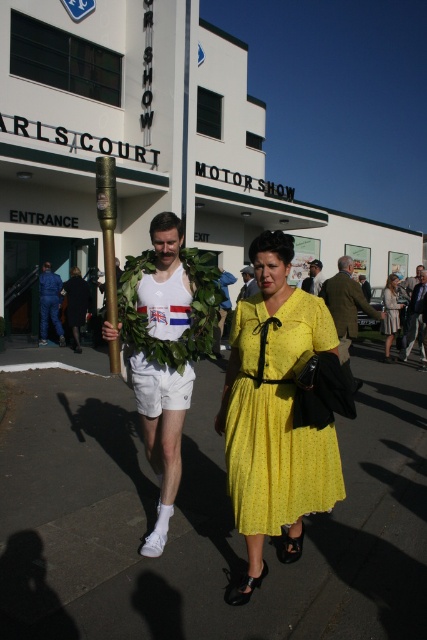
Question: Based on their relative distances, which object is nearer to the blue denim jumpsuit at center?

Choices:
 (A) matte white tank top at center
 (B) green fabric coat at center
 (C) yellow fabric dress at center

Answer: (A)

Question: Which object appears farthest from the camera in this image?

Choices:
 (A) white cotton shorts at center
 (B) blue denim jumpsuit at center
 (C) dark gray asphalt at center

Answer: (B)

Question: Does white fabric shorts at center appear over yellow fabric dress at center?

Choices:
 (A) no
 (B) yes

Answer: (A)

Question: Estimate the real-world distances between objects in this image. Which object is closer to the green fabric coat at center?

Choices:
 (A) matte white tank top at center
 (B) yellow satin dress at center
 (C) blue denim jumpsuit at center

Answer: (A)

Question: Can you confirm if white fabric shorts at center is smaller than white cotton shorts at center?

Choices:
 (A) yes
 (B) no

Answer: (A)

Question: Is yellow fabric dress at center below matte gold torch at center?

Choices:
 (A) no
 (B) yes

Answer: (B)